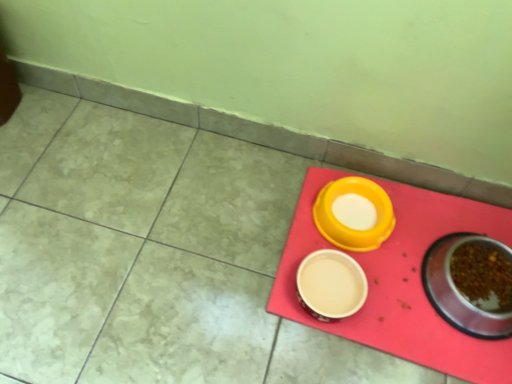
Locate an element on the screen. free space on the front side of beige ceramic bowl at center, the first tableware in the left-to-right sequence is located at coordinates (321, 350).